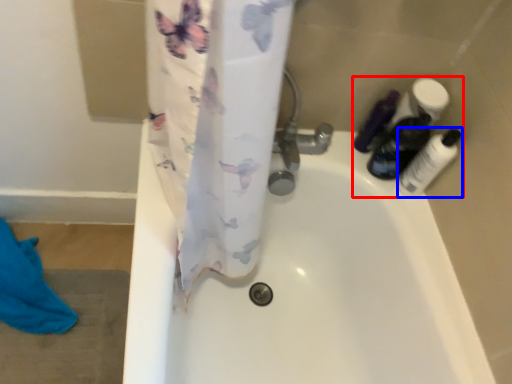
Question: Which point is further to the camera, toiletry (highlighted by a red box) or toiletry (highlighted by a blue box)?

Choices:
 (A) toiletry
 (B) toiletry

Answer: (A)